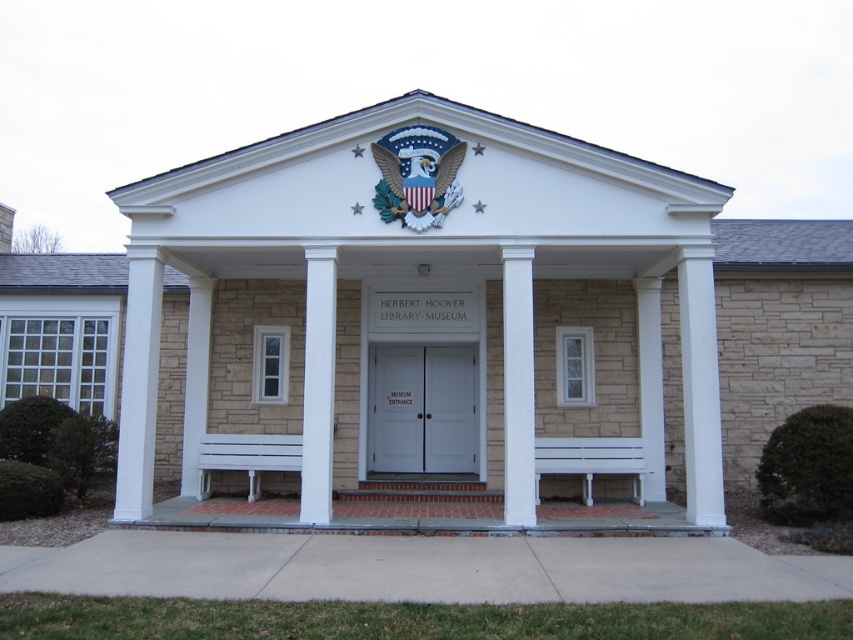
Question: Is white wooden doors at center above white painted wood column at center?

Choices:
 (A) no
 (B) yes

Answer: (A)

Question: Is white wooden doors at center smaller than white smooth column at center?

Choices:
 (A) no
 (B) yes

Answer: (A)

Question: From the image, what is the correct spatial relationship of white wooden doors at center in relation to white painted wood column at center?

Choices:
 (A) above
 (B) below

Answer: (B)

Question: Which object is farther from the camera taking this photo?

Choices:
 (A) white stone column at left
 (B) white wooden doors at center
 (C) white smooth column at center
 (D) white painted wood column at center

Answer: (B)

Question: Which object is the farthest from the white wooden doors at center?

Choices:
 (A) white smooth column at center
 (B) white stone column at left
 (C) white painted wood column at center

Answer: (B)

Question: Based on their relative distances, which object is farther from the white painted wood column at center?

Choices:
 (A) white smooth column at center
 (B) white stone column at left

Answer: (B)